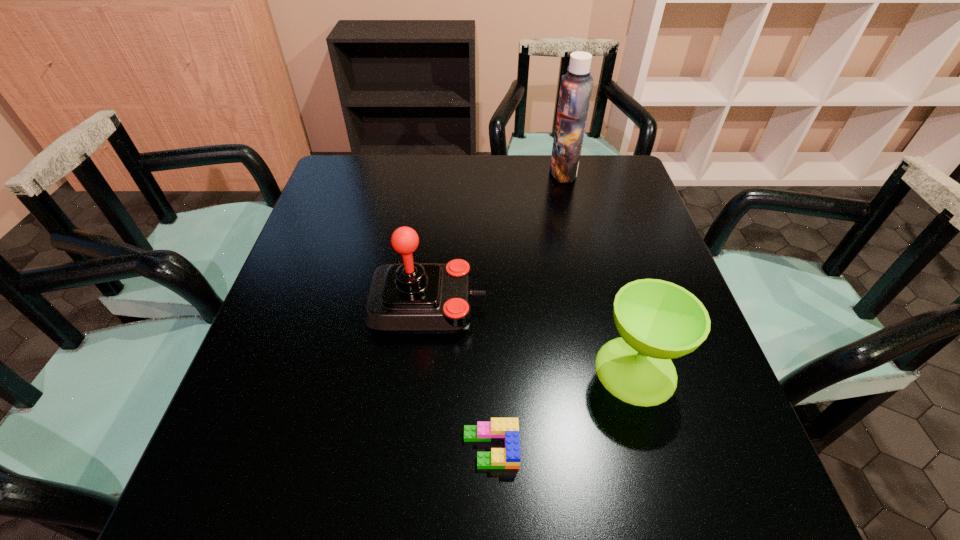
In order to click on vacant region that satisfies the following two spatial constraints: 1. on the front label of the wineglass; 2. on the right side of the tallest object in this screenshot , I will do `click(610, 370)`.

I want to click on free space that satisfies the following two spatial constraints: 1. on the base of the joystick; 2. on the left side of the shortest object, so (412, 448).

Identify the location of free space that satisfies the following two spatial constraints: 1. on the base of the shortest object; 2. on the left side of the second tallest object. (412, 448).

Locate an element on the screen. Image resolution: width=960 pixels, height=540 pixels. vacant region that satisfies the following two spatial constraints: 1. on the base of the Lego; 2. on the right side of the second tallest object is located at coordinates (412, 448).

The image size is (960, 540). In order to click on free space in the image that satisfies the following two spatial constraints: 1. on the front label of the farthest object; 2. on the front side of the shortest object in this screenshot , I will do `click(629, 448)`.